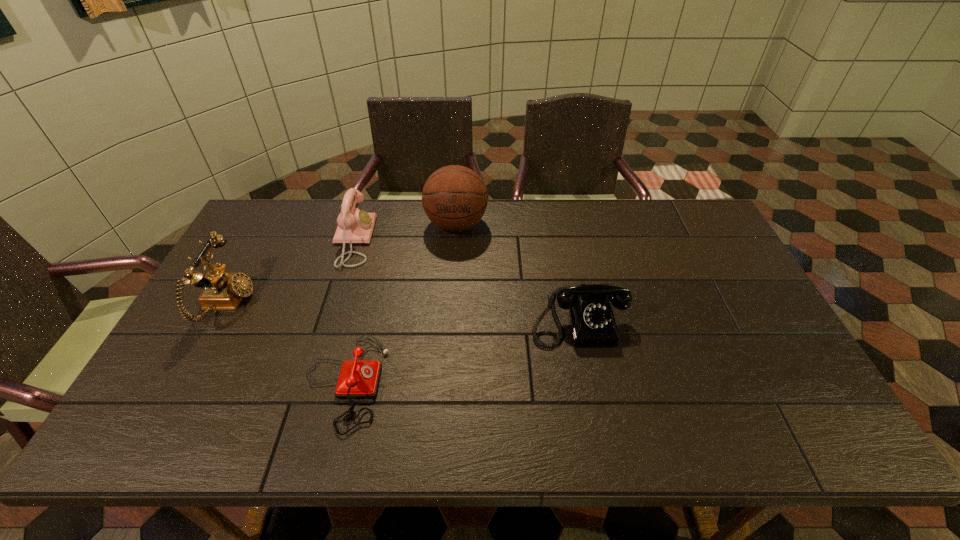
This screenshot has height=540, width=960. I want to click on free space at the far left corner, so click(x=300, y=206).

In the image, there is a desktop. Find the location of `vacant space at the near left corner`. vacant space at the near left corner is located at coordinates (185, 423).

Where is `unoccupied area between the shortest object and the farthest telephone`? The height and width of the screenshot is (540, 960). unoccupied area between the shortest object and the farthest telephone is located at coordinates (348, 311).

At what (x,y) coordinates should I click in order to perform the action: click on unoccupied position between the shortest telephone and the farthest telephone. Please return your answer as a coordinate pair (x, y). The image size is (960, 540). Looking at the image, I should click on (348, 311).

I want to click on vacant space in between the shortest telephone and the basketball, so click(400, 303).

Locate an element on the screen. This screenshot has height=540, width=960. empty location between the farthest telephone and the leftmost telephone is located at coordinates (291, 272).

The image size is (960, 540). I want to click on free space between the rightmost object and the second tallest object, so click(x=402, y=310).

The height and width of the screenshot is (540, 960). In order to click on free space that is in between the second tallest object and the rightmost telephone in this screenshot , I will do `click(402, 310)`.

This screenshot has height=540, width=960. In order to click on vacant space in between the tallest object and the farthest telephone in this screenshot , I will do `click(405, 232)`.

The width and height of the screenshot is (960, 540). I want to click on blank region between the basketball and the farthest telephone, so click(x=405, y=232).